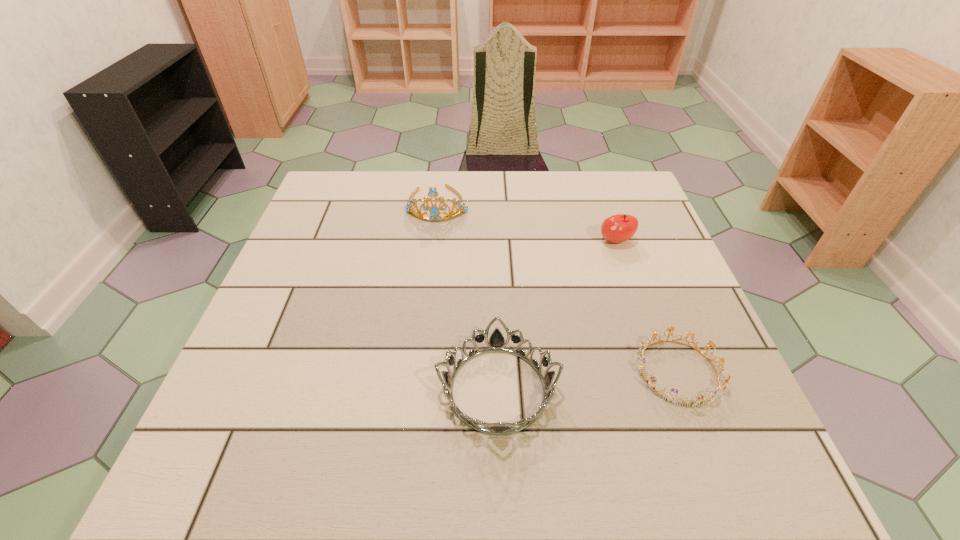
In order to click on object that is at the near edge in this screenshot , I will do `click(496, 343)`.

In order to click on apple that is at the right edge in this screenshot , I will do `click(618, 228)`.

The image size is (960, 540). What are the coordinates of `tiara present at the right edge` in the screenshot? It's located at (689, 402).

Locate an element on the screen. Image resolution: width=960 pixels, height=540 pixels. free space at the far edge of the desktop is located at coordinates (384, 195).

In the image, there is a desktop. What are the coordinates of `vacant area at the near edge` in the screenshot? It's located at coord(315,487).

Image resolution: width=960 pixels, height=540 pixels. In order to click on vacant space at the left edge of the desktop in this screenshot , I will do `click(342, 247)`.

The image size is (960, 540). What are the coordinates of `free spot at the right edge of the desktop` in the screenshot? It's located at (717, 346).

Identify the location of vacant space at the far left corner of the desktop. This screenshot has width=960, height=540. (327, 199).

Find the location of a particular element. vacant space at the far right corner of the desktop is located at coordinates (612, 180).

Locate an element on the screen. Image resolution: width=960 pixels, height=540 pixels. free space between the shortest object and the second shortest object is located at coordinates (588, 381).